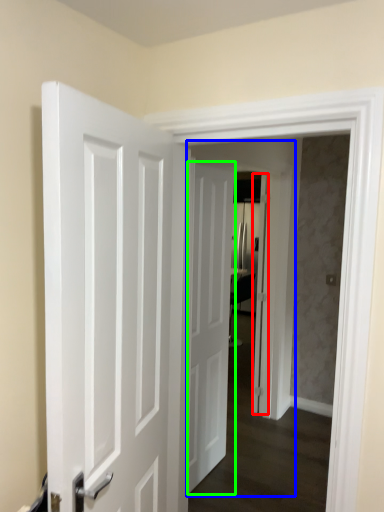
Question: Considering the real-world distances, which object is farthest from door (highlighted by a red box)? screen door (highlighted by a blue box) or door (highlighted by a green box)?

Choices:
 (A) screen door
 (B) door

Answer: (B)